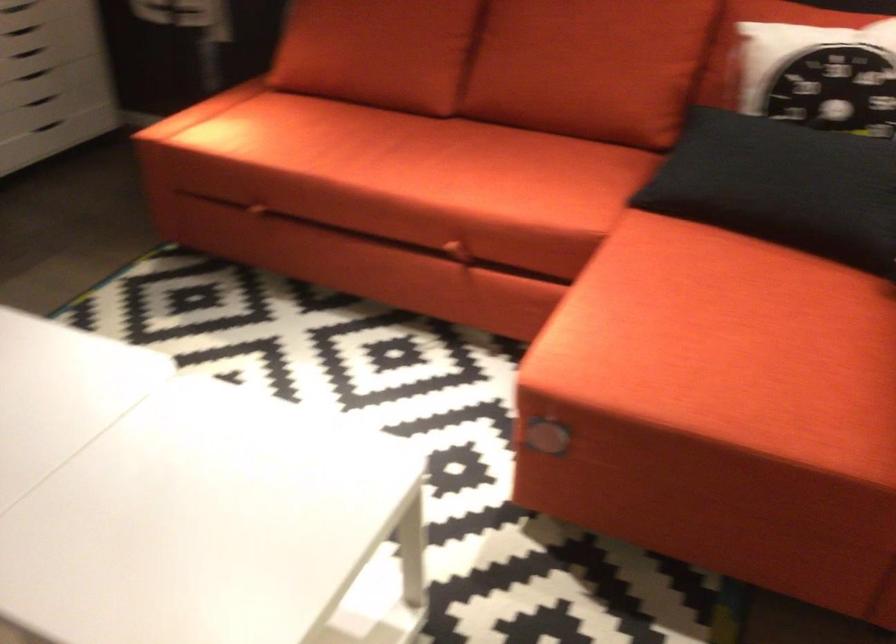
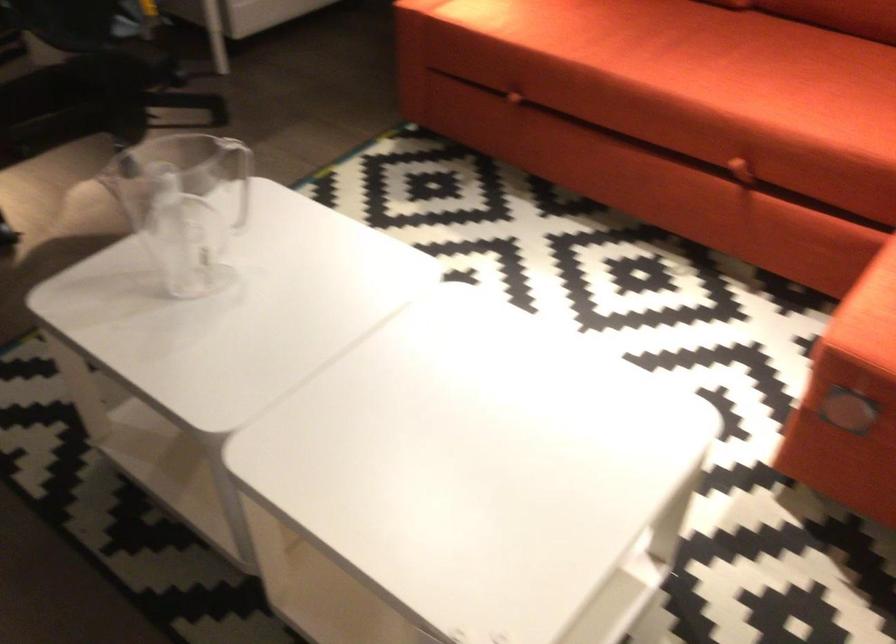
Locate, in the second image, the point that corresponds to (259,209) in the first image.

(512, 96)